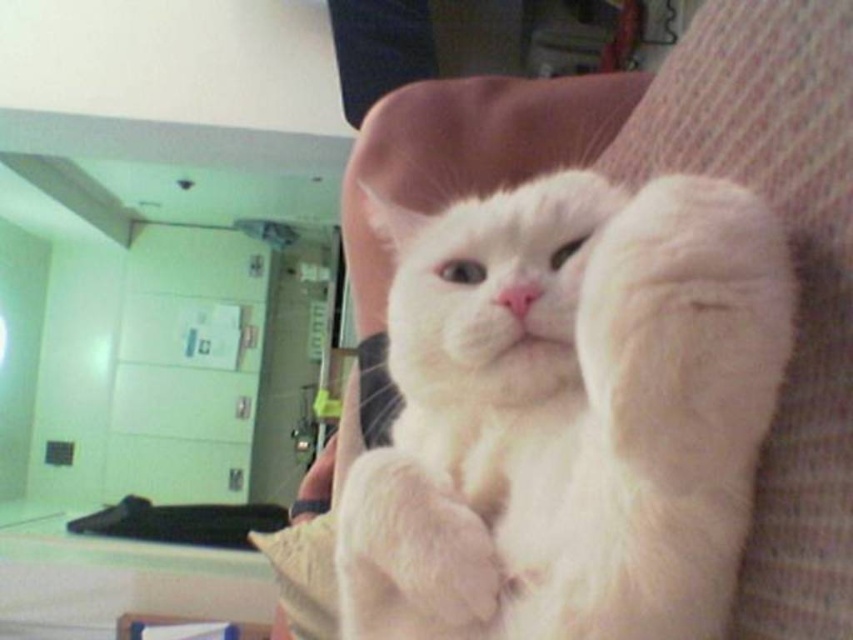
Question: Does white fluffy cat at center appear on the right side of white fluffy paw at center?

Choices:
 (A) no
 (B) yes

Answer: (B)

Question: Is white fluffy cat at center closer to the viewer compared to white fluffy paw at center?

Choices:
 (A) yes
 (B) no

Answer: (A)

Question: Which object appears farthest from the camera in this image?

Choices:
 (A) white fluffy paw at center
 (B) white fluffy cat at center

Answer: (A)

Question: Is the position of white fluffy cat at center less distant than that of white fluffy paw at center?

Choices:
 (A) yes
 (B) no

Answer: (A)

Question: Which point appears farthest from the camera in this image?

Choices:
 (A) tap(399, 541)
 (B) tap(426, 588)

Answer: (A)

Question: Which point is closer to the camera taking this photo?

Choices:
 (A) (521, 524)
 (B) (360, 573)

Answer: (A)